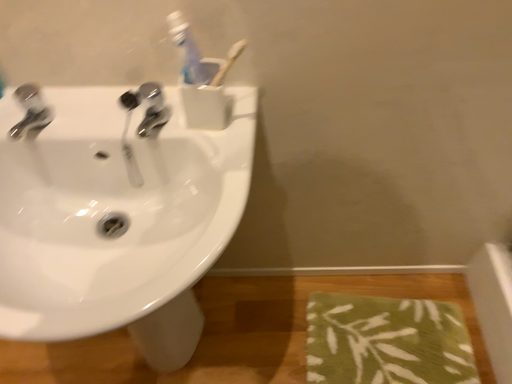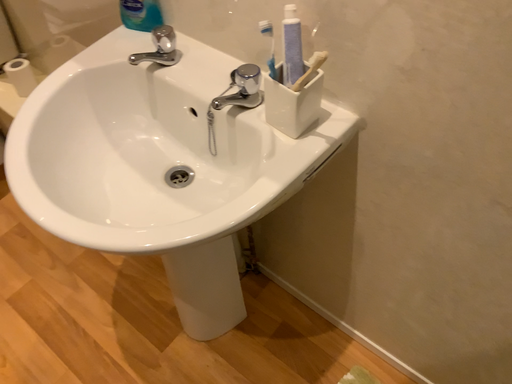
Question: How did the camera likely rotate when shooting the video?

Choices:
 (A) rotated right
 (B) rotated left

Answer: (B)